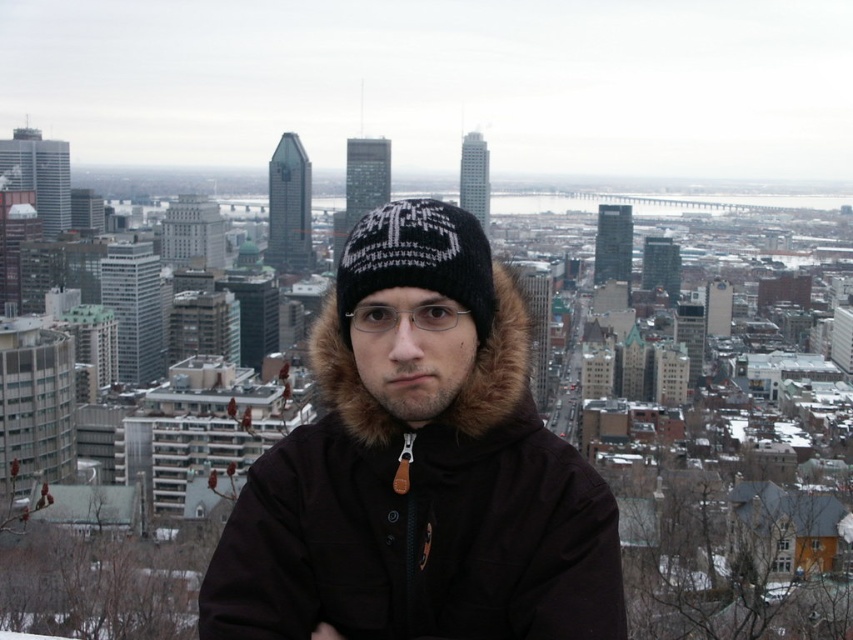
From the picture: You are a photographer trying to capture the city skyline. You notice a person wearing a dark brown jacket with a fur lined hood standing in front of the three prominent towers. Where is the point at coordinate (419, 467) located on the person?

The point at coordinate (419, 467) is located on the brown fur lined coat at center.